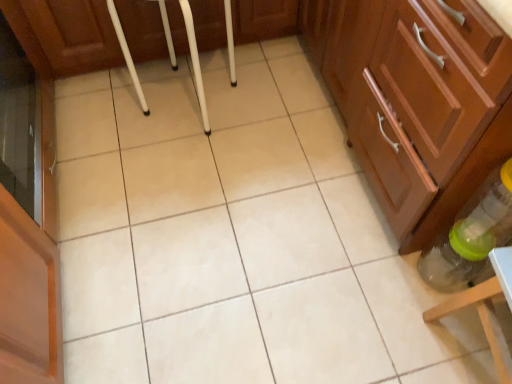
Identify the location of free space to the left of white plastic bar stool at center. (99, 122).